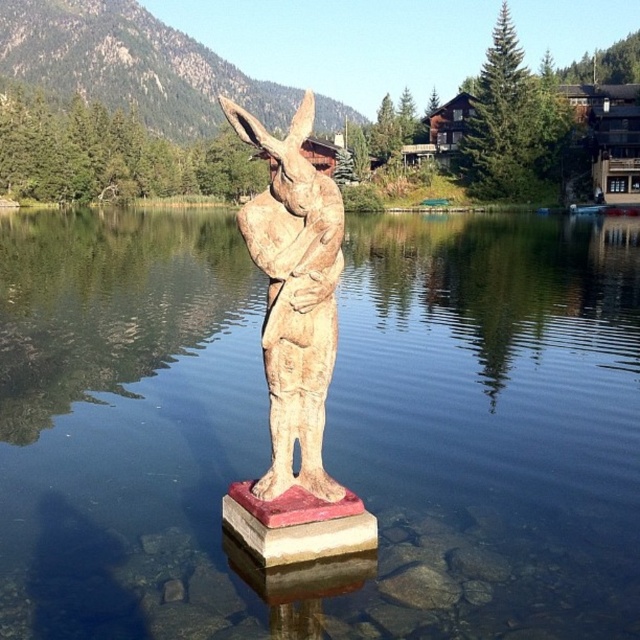
Question: Is clear water at statue center bigger than wooden statue at center?

Choices:
 (A) no
 (B) yes

Answer: (B)

Question: Is clear water at statue center wider than wooden statue at center?

Choices:
 (A) no
 (B) yes

Answer: (B)

Question: Is clear water at statue center above wooden statue at center?

Choices:
 (A) yes
 (B) no

Answer: (A)

Question: Which point appears closest to the camera in this image?

Choices:
 (A) (259, 554)
 (B) (401, 246)

Answer: (A)